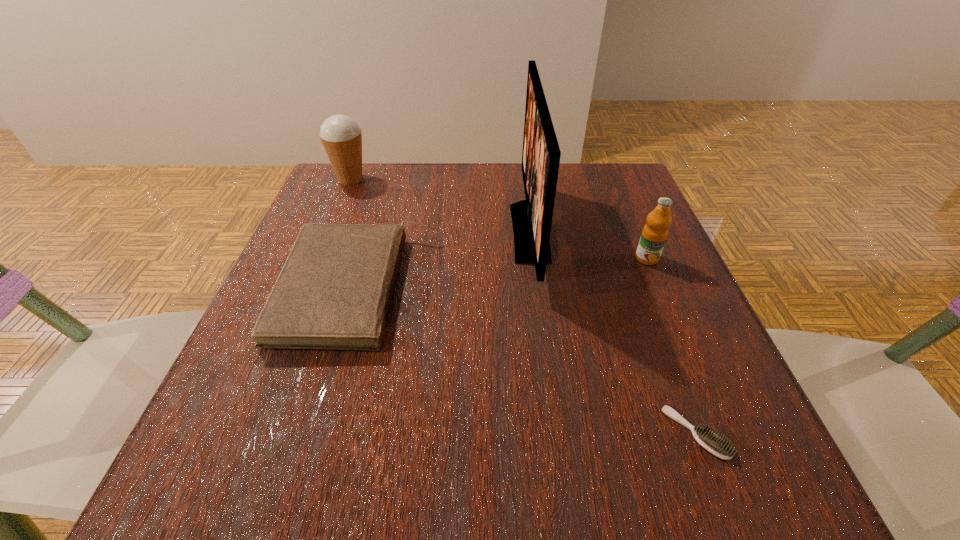
This screenshot has height=540, width=960. I want to click on vacant area that lies between the third object from right to left and the third tallest object, so click(x=588, y=245).

You are a GUI agent. You are given a task and a screenshot of the screen. Output one action in this format:
    pyautogui.click(x=<x>, y=<y>)
    Task: Click on the free space between the paperback book and the third tallest object
    The height and width of the screenshot is (540, 960).
    Given the screenshot: What is the action you would take?
    pyautogui.click(x=503, y=273)

I want to click on unoccupied position between the third shortest object and the third object from left to right, so click(588, 245).

The height and width of the screenshot is (540, 960). Find the location of `vacant space in between the icecream and the scrubbing brush`. vacant space in between the icecream and the scrubbing brush is located at coordinates (523, 306).

I want to click on free space between the shortest object and the tallest object, so click(612, 333).

This screenshot has width=960, height=540. In order to click on unoccupied position between the third shortest object and the monitor in this screenshot , I will do `click(588, 245)`.

Find the location of a particular element. This screenshot has height=540, width=960. vacant point located between the paperback book and the orange juice is located at coordinates (503, 273).

At what (x,y) coordinates should I click in order to perform the action: click on free space between the orange juice and the icecream. Please return your answer as a coordinate pair (x, y). The height and width of the screenshot is (540, 960). Looking at the image, I should click on (499, 219).

In order to click on empty space between the third tallest object and the icecream in this screenshot , I will do `click(499, 219)`.

The width and height of the screenshot is (960, 540). I want to click on object that is the closest one to the paperback book, so click(532, 218).